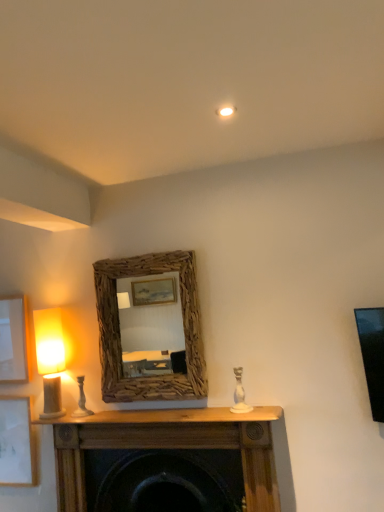
The image size is (384, 512). Find the location of `matte white picture frame at left, the 2th picture frame ordered from the bottom`. matte white picture frame at left, the 2th picture frame ordered from the bottom is located at coordinates 13,340.

How much space does white ceramic candle holder at left, placed as the 1th candle holder when sorted from back to front, occupy vertically?

8.97 inches.

Consider the image. How much space does white matte picture frame at lower left, which is the 1th picture frame from bottom to top, occupy horizontally?

1.66 inches.

The image size is (384, 512). Identify the location of wooden mantel at center. (169, 445).

Where is `matte beige lampshade at left`? The width and height of the screenshot is (384, 512). matte beige lampshade at left is located at coordinates (50, 359).

Describe the element at coordinates (50, 359) in the screenshot. I see `matte beige lampshade at left` at that location.

This screenshot has height=512, width=384. In order to click on matte white picture frame at left, the 2th picture frame ordered from the bottom in this screenshot , I will do `click(13, 340)`.

Is matte beige lampshade at left thinner than white ceramic candle holder at center, acting as the second candle holder starting from the back?

In fact, matte beige lampshade at left might be wider than white ceramic candle holder at center, acting as the second candle holder starting from the back.

From the image's perspective, which one is positioned higher, matte beige lampshade at left or white ceramic candle holder at center, arranged as the first candle holder when viewed from the right?

matte beige lampshade at left appears higher in the image.

Consider the image. Is matte beige lampshade at left far from white ceramic candle holder at center, acting as the second candle holder starting from the back?

Absolutely, matte beige lampshade at left is distant from white ceramic candle holder at center, acting as the second candle holder starting from the back.

In the scene shown: What's the angular difference between matte beige lampshade at left and white ceramic candle holder at center, which ranks as the 1th candle holder in front-to-back order,'s facing directions?

The facing directions of matte beige lampshade at left and white ceramic candle holder at center, which ranks as the 1th candle holder in front-to-back order, are 2.62 degrees apart.

From a real-world perspective, is white ceramic candle holder at left, positioned as the second candle holder in right-to-left order, positioned over driftwood mirror at center based on gravity?

No, from a real-world perspective, white ceramic candle holder at left, positioned as the second candle holder in right-to-left order, is not above driftwood mirror at center.

Which is behind, white ceramic candle holder at left, the first candle holder in the left-to-right sequence, or driftwood mirror at center?

white ceramic candle holder at left, the first candle holder in the left-to-right sequence, is further away from the camera.

In the scene shown: Can you confirm if white ceramic candle holder at left, the first candle holder in the left-to-right sequence, is smaller than driftwood mirror at center?

Correct, white ceramic candle holder at left, the first candle holder in the left-to-right sequence, occupies less space than driftwood mirror at center.

What's the angular difference between wooden mantel at center and white ceramic candle holder at center, which is counted as the 2th candle holder, starting from the left,'s facing directions?

There is a 2.61-degree angle between the facing directions of wooden mantel at center and white ceramic candle holder at center, which is counted as the 2th candle holder, starting from the left.

Is wooden mantel at center positioned with its back to white ceramic candle holder at center, which ranks as the 1th candle holder in front-to-back order?

No, wooden mantel at center's orientation is not away from white ceramic candle holder at center, which ranks as the 1th candle holder in front-to-back order.

In the scene shown: Is wooden mantel at center placed right next to white ceramic candle holder at center, acting as the second candle holder starting from the back?

wooden mantel at center is not next to white ceramic candle holder at center, acting as the second candle holder starting from the back, and they're not touching.

Identify the location of table lying on the left of white ceramic candle holder at center, arranged as the first candle holder when viewed from the right. [x=169, y=445].

From the picture: Who is taller, white matte picture frame at lower left, which is counted as the second picture frame, starting from the top, or driftwood mirror at center?

driftwood mirror at center is taller.

In the scene shown: Between white matte picture frame at lower left, which is the 1th picture frame from bottom to top, and driftwood mirror at center, which one is positioned in front?

driftwood mirror at center is more forward.

Looking at this image, from the image's perspective, between white matte picture frame at lower left, which is the 1th picture frame from bottom to top, and driftwood mirror at center, which one is located above?

From the image's view, driftwood mirror at center is above.

Looking at their sizes, would you say matte white picture frame at left, the 1th picture frame from the top, is wider or thinner than wooden mantel at center?

In the image, matte white picture frame at left, the 1th picture frame from the top, appears to be more narrow than wooden mantel at center.

Which is more to the left, matte white picture frame at left, the 2th picture frame ordered from the bottom, or wooden mantel at center?

matte white picture frame at left, the 2th picture frame ordered from the bottom, is more to the left.

This screenshot has height=512, width=384. What are the coordinates of `table to the right of matte white picture frame at left, the 1th picture frame from the top` in the screenshot? It's located at (169, 445).

Is matte white picture frame at left, the 2th picture frame ordered from the bottom, aimed at wooden mantel at center?

No, matte white picture frame at left, the 2th picture frame ordered from the bottom, is not turned towards wooden mantel at center.

Which object is further away from the camera, white ceramic candle holder at left, marked as the 2th candle holder in a front-to-back arrangement, or matte beige lampshade at left?

white ceramic candle holder at left, marked as the 2th candle holder in a front-to-back arrangement, is further from the camera.

Is white ceramic candle holder at left, placed as the 1th candle holder when sorted from back to front, directly adjacent to matte beige lampshade at left?

No, white ceramic candle holder at left, placed as the 1th candle holder when sorted from back to front, is not in contact with matte beige lampshade at left.

Which object is thinner, white ceramic candle holder at left, marked as the 2th candle holder in a front-to-back arrangement, or matte beige lampshade at left?

Thinner between the two is white ceramic candle holder at left, marked as the 2th candle holder in a front-to-back arrangement.

Looking at this image, can you confirm if white ceramic candle holder at left, the first candle holder in the left-to-right sequence, is bigger than matte beige lampshade at left?

No.

Is white ceramic candle holder at center, acting as the second candle holder starting from the back, not near white matte picture frame at lower left, which is counted as the second picture frame, starting from the top?

white ceramic candle holder at center, acting as the second candle holder starting from the back, is positioned a significant distance from white matte picture frame at lower left, which is counted as the second picture frame, starting from the top.

Is white ceramic candle holder at center, arranged as the first candle holder when viewed from the right, oriented towards white matte picture frame at lower left, which is counted as the second picture frame, starting from the top?

No, white ceramic candle holder at center, arranged as the first candle holder when viewed from the right, is not oriented towards white matte picture frame at lower left, which is counted as the second picture frame, starting from the top.

Considering the positions of objects white ceramic candle holder at center, arranged as the first candle holder when viewed from the right, and white matte picture frame at lower left, which is the 1th picture frame from bottom to top, in the image provided, who is more to the left, white ceramic candle holder at center, arranged as the first candle holder when viewed from the right, or white matte picture frame at lower left, which is the 1th picture frame from bottom to top,?

white matte picture frame at lower left, which is the 1th picture frame from bottom to top.

How distant is white ceramic candle holder at center, arranged as the first candle holder when viewed from the right, from white matte picture frame at lower left, which is the 1th picture frame from bottom to top?

1.35 meters.

You are a GUI agent. You are given a task and a screenshot of the screen. Output one action in this format:
    pyautogui.click(x=<x>, y=<y>)
    Task: Click on the table lamp on the left of white ceramic candle holder at center, acting as the second candle holder starting from the back
    
    Given the screenshot: What is the action you would take?
    pyautogui.click(x=50, y=359)

What are the coordinates of `candle holder behind the driftwood mirror at center` in the screenshot? It's located at (81, 400).

Which object lies nearer to the anchor point white matte picture frame at lower left, which is the 1th picture frame from bottom to top, white ceramic candle holder at center, which is counted as the 2th candle holder, starting from the left, or wooden mantel at center?

The object closer to white matte picture frame at lower left, which is the 1th picture frame from bottom to top, is wooden mantel at center.

Looking at the image, which one is located closer to driftwood mirror at center, matte white picture frame at left, the 1th picture frame from the top, or matte beige lampshade at left?

The object closer to driftwood mirror at center is matte beige lampshade at left.

Considering their positions, is matte beige lampshade at left positioned further to matte white picture frame at left, the 1th picture frame from the top, than wooden mantel at center?

Among the two, wooden mantel at center is located further to matte white picture frame at left, the 1th picture frame from the top.

Looking at the image, which one is located closer to matte white picture frame at left, the 2th picture frame ordered from the bottom, driftwood mirror at center or white ceramic candle holder at left, the first candle holder in the left-to-right sequence?

white ceramic candle holder at left, the first candle holder in the left-to-right sequence, lies closer to matte white picture frame at left, the 2th picture frame ordered from the bottom, than the other object.

Which object lies further to the anchor point white ceramic candle holder at left, marked as the 2th candle holder in a front-to-back arrangement, wooden mantel at center or matte white picture frame at left, the 2th picture frame ordered from the bottom?

Among the two, matte white picture frame at left, the 2th picture frame ordered from the bottom, is located further to white ceramic candle holder at left, marked as the 2th candle holder in a front-to-back arrangement.

From the image, which object appears to be nearer to white matte picture frame at lower left, which is counted as the second picture frame, starting from the top, matte beige lampshade at left or matte white picture frame at left, the 2th picture frame ordered from the bottom?

matte white picture frame at left, the 2th picture frame ordered from the bottom.

Estimate the real-world distances between objects in this image. Which object is further from white ceramic candle holder at left, marked as the 2th candle holder in a front-to-back arrangement, white ceramic candle holder at center, which ranks as the 1th candle holder in front-to-back order, or white matte picture frame at lower left, which is the 1th picture frame from bottom to top?

Based on the image, white ceramic candle holder at center, which ranks as the 1th candle holder in front-to-back order, appears to be further to white ceramic candle holder at left, marked as the 2th candle holder in a front-to-back arrangement.

Estimate the real-world distances between objects in this image. Which object is further from matte beige lampshade at left, driftwood mirror at center or matte white picture frame at left, the 1th picture frame from the top?

driftwood mirror at center is positioned further to the anchor matte beige lampshade at left.

Locate an element on the screen. The image size is (384, 512). candle holder between white matte picture frame at lower left, which is the 1th picture frame from bottom to top, and white ceramic candle holder at center, arranged as the first candle holder when viewed from the right is located at coordinates (81, 400).

Where is `table between white matte picture frame at lower left, which is counted as the second picture frame, starting from the top, and white ceramic candle holder at center, arranged as the first candle holder when viewed from the right`? table between white matte picture frame at lower left, which is counted as the second picture frame, starting from the top, and white ceramic candle holder at center, arranged as the first candle holder when viewed from the right is located at coordinates click(169, 445).

You are a GUI agent. You are given a task and a screenshot of the screen. Output one action in this format:
    pyautogui.click(x=<x>, y=<y>)
    Task: Click on the candle holder between white matte picture frame at lower left, which is counted as the second picture frame, starting from the top, and driftwood mirror at center, in the horizontal direction
    This screenshot has width=384, height=512.
    Given the screenshot: What is the action you would take?
    pyautogui.click(x=81, y=400)

The height and width of the screenshot is (512, 384). I want to click on candle holder situated between matte beige lampshade at left and white ceramic candle holder at center, which is counted as the 2th candle holder, starting from the left, from left to right, so tap(81, 400).